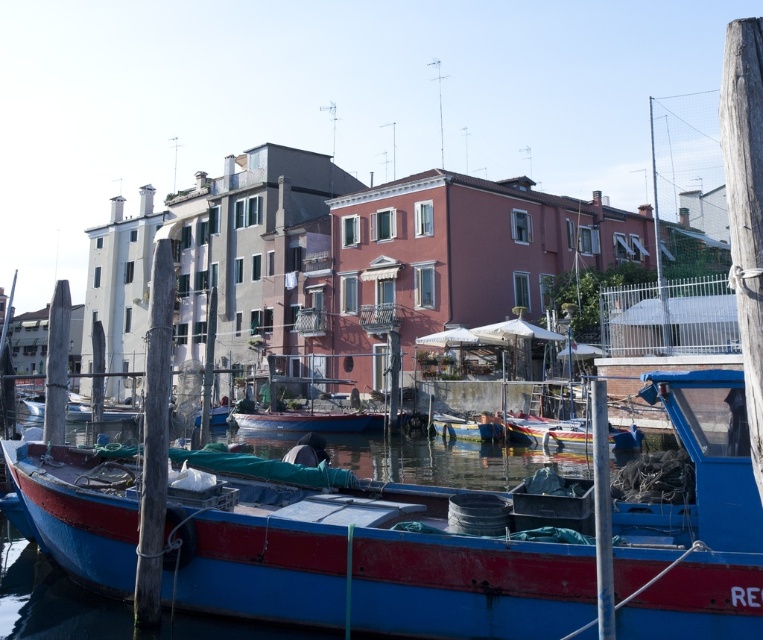
The image size is (763, 640). Find the location of `blue matte boat at lower left`. blue matte boat at lower left is located at coordinates (378, 554).